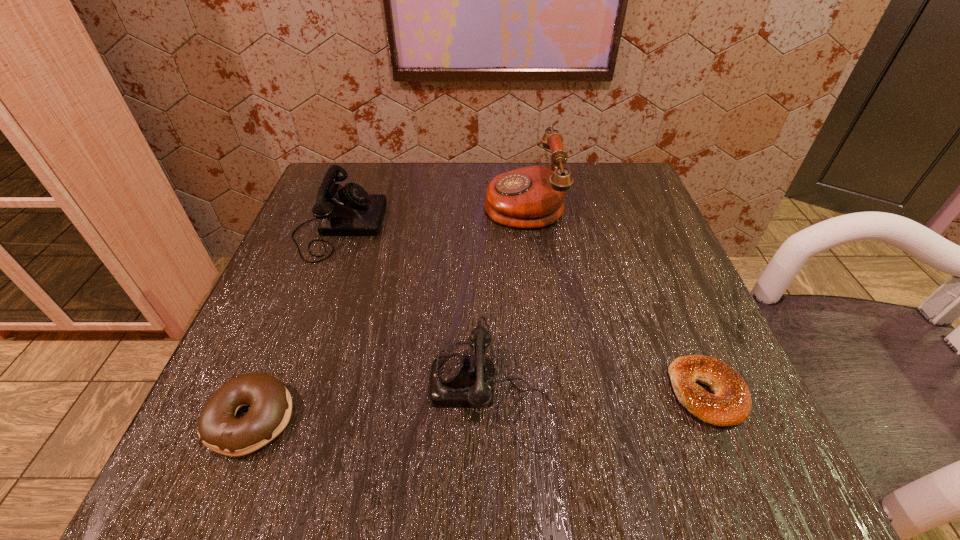
Find the location of a particular element. Image resolution: width=960 pixels, height=540 pixels. doughnut located in the left edge section of the desktop is located at coordinates (270, 402).

Find the location of `object positioned at the right edge`. object positioned at the right edge is located at coordinates (731, 404).

You are a GUI agent. You are given a task and a screenshot of the screen. Output one action in this format:
    pyautogui.click(x=<x>, y=<y>)
    Task: Click on the object located in the far left corner section of the desktop
    Image resolution: width=960 pixels, height=540 pixels.
    Given the screenshot: What is the action you would take?
    pyautogui.click(x=349, y=210)

At what (x,y) coordinates should I click in order to perform the action: click on object that is at the near left corner. Please return your answer as a coordinate pair (x, y). This screenshot has width=960, height=540. Looking at the image, I should click on (270, 402).

Where is `object at the near right corner`? object at the near right corner is located at coordinates (731, 404).

In the image, there is a desktop. At what (x,y) coordinates should I click in order to perform the action: click on vacant area at the far edge. Please return your answer as a coordinate pair (x, y). The width and height of the screenshot is (960, 540). Looking at the image, I should click on (473, 167).

Identify the location of free space at the near edge of the desktop. tap(574, 421).

Identify the location of vacant space at the left edge of the desktop. (279, 295).

At what (x,y) coordinates should I click in order to perform the action: click on vacant space at the right edge of the desktop. Please return your answer as a coordinate pair (x, y). The width and height of the screenshot is (960, 540). Looking at the image, I should click on (686, 294).

In the image, there is a desktop. At what (x,y) coordinates should I click in order to perform the action: click on vacant space at the far left corner. Please return your answer as a coordinate pair (x, y). The width and height of the screenshot is (960, 540). Looking at the image, I should click on (301, 220).